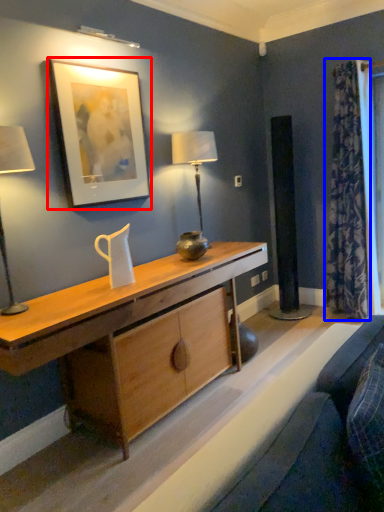
Question: Which object appears farthest to the camera in this image, picture frame (highlighted by a red box) or curtain (highlighted by a blue box)?

Choices:
 (A) picture frame
 (B) curtain

Answer: (B)